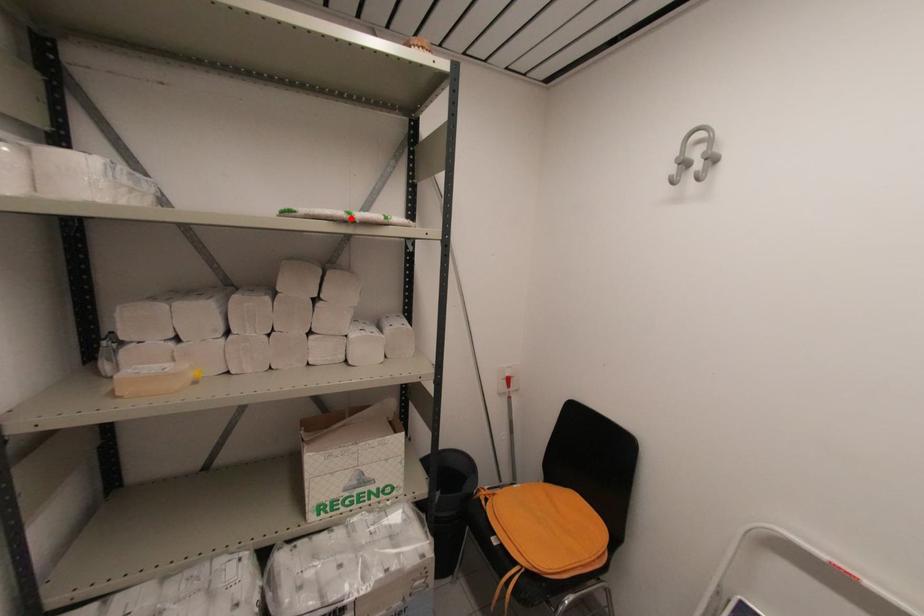
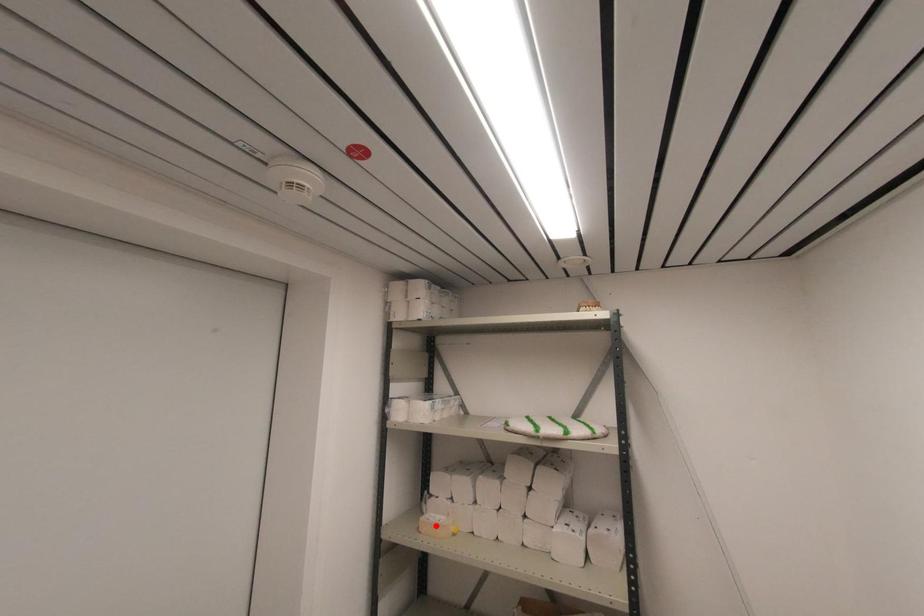
I am providing you with two images of the same scene from different viewpoints. A red point is marked on the first image and another point is marked on the second image. Is the red point in image1 aligned with the point shown in image2?

No